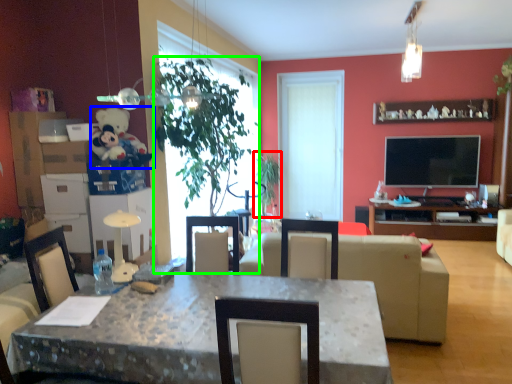
Question: Which object is positioned farthest from plant (highlighted by a red box)? Select from teddy bear (highlighted by a blue box) and houseplant (highlighted by a green box).

Choices:
 (A) teddy bear
 (B) houseplant

Answer: (A)